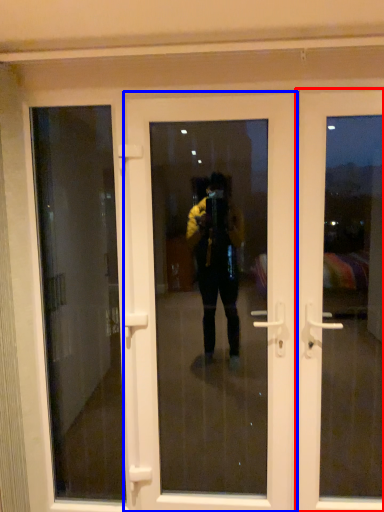
Question: Which of the following is the closest to the observer, door (highlighted by a red box) or door (highlighted by a blue box)?

Choices:
 (A) door
 (B) door

Answer: (A)